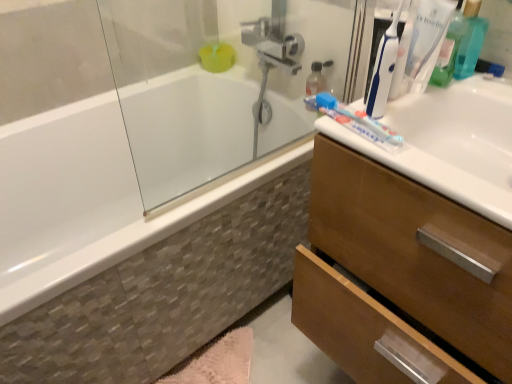
Locate an element on the screen. The image size is (512, 384). blue plastic toothbrush at upper right, marked as the second toothbrush in a right-to-left arrangement is located at coordinates (381, 61).

Describe the element at coordinates (218, 362) in the screenshot. I see `pink fluffy bath mat at lower center` at that location.

The image size is (512, 384). Describe the element at coordinates (160, 136) in the screenshot. I see `white glossy bathtub at left` at that location.

Identify the location of white glossy sink at upper right. pyautogui.click(x=450, y=143).

Who is taller, white glossy sink at upper right or pink fluffy bath mat at lower center?

Standing taller between the two is white glossy sink at upper right.

From a real-world perspective, relative to pink fluffy bath mat at lower center, is white glossy sink at upper right vertically above or below?

white glossy sink at upper right is situated higher than pink fluffy bath mat at lower center in the real world.

Which is in front, white glossy sink at upper right or pink fluffy bath mat at lower center?

white glossy sink at upper right is more forward.

What's the angular difference between white glossy sink at upper right and pink fluffy bath mat at lower center's facing directions?

They differ by 90 degrees in their facing directions.

Are white glossy bathtub at left and pink fluffy bath mat at lower center far apart?

That's not correct — white glossy bathtub at left is a little close to pink fluffy bath mat at lower center.

Considering the sizes of objects white glossy bathtub at left and pink fluffy bath mat at lower center in the image provided, who is thinner, white glossy bathtub at left or pink fluffy bath mat at lower center?

pink fluffy bath mat at lower center.

Considering the relative sizes of white glossy bathtub at left and pink fluffy bath mat at lower center in the image provided, is white glossy bathtub at left shorter than pink fluffy bath mat at lower center?

No, white glossy bathtub at left is not shorter than pink fluffy bath mat at lower center.

Which object is positioned more to the right, white glossy bathtub at left or white glossy sink at upper right?

Positioned to the right is white glossy sink at upper right.

Where is `sink positioned vertically above the white glossy bathtub at left (from a real-world perspective)`? The height and width of the screenshot is (384, 512). sink positioned vertically above the white glossy bathtub at left (from a real-world perspective) is located at coordinates (450, 143).

Is white glossy sink at upper right a part of white glossy bathtub at left?

No, white glossy sink at upper right is not surrounded by white glossy bathtub at left.

From the image's perspective, is wooden cabinet at right beneath white glossy bathtub at left?

Yes.

Considering the sizes of objects wooden cabinet at right and white glossy bathtub at left in the image provided, who is bigger, wooden cabinet at right or white glossy bathtub at left?

With larger size is white glossy bathtub at left.

Choose the correct answer: Is wooden cabinet at right inside white glossy bathtub at left or outside it?

wooden cabinet at right is not inside white glossy bathtub at left, it's outside.

How different are the orientations of white glossy sink at upper right and translucent plastic toothbrush at upper right, the second toothbrush in the left-to-right sequence, in degrees?

white glossy sink at upper right and translucent plastic toothbrush at upper right, the second toothbrush in the left-to-right sequence, are facing 0.459 degrees away from each other.

Based on the photo, is white glossy sink at upper right situated inside translucent plastic toothbrush at upper right, the second toothbrush in the left-to-right sequence, or outside?

white glossy sink at upper right exists outside the volume of translucent plastic toothbrush at upper right, the second toothbrush in the left-to-right sequence.

From a real-world perspective, which is physically below, white glossy sink at upper right or translucent plastic toothbrush at upper right, the second toothbrush in the left-to-right sequence?

white glossy sink at upper right is physically lower.

Does white glossy bathtub at left come in front of blue plastic toothbrush at upper right, acting as the 1th toothbrush starting from the left?

No.

The image size is (512, 384). In order to click on bathtub below the blue plastic toothbrush at upper right, marked as the second toothbrush in a right-to-left arrangement (from the image's perspective) in this screenshot , I will do `click(160, 136)`.

Is white glossy bathtub at left turned away from blue plastic toothbrush at upper right, acting as the 1th toothbrush starting from the left?

That's not correct — white glossy bathtub at left is not looking away from blue plastic toothbrush at upper right, acting as the 1th toothbrush starting from the left.

Considering the positions of point (148, 32) and point (390, 30), is point (148, 32) closer or farther from the camera than point (390, 30)?

Point (148, 32) is farther from the camera than point (390, 30).

From a real-world perspective, is translucent plastic toothbrush at upper right, the first toothbrush viewed from the right, located higher than white glossy sink at upper right?

Yes, from a real-world perspective, translucent plastic toothbrush at upper right, the first toothbrush viewed from the right, is over white glossy sink at upper right

Considering the relative positions of translucent plastic toothbrush at upper right, the first toothbrush viewed from the right, and white glossy sink at upper right in the image provided, is translucent plastic toothbrush at upper right, the first toothbrush viewed from the right, to the left of white glossy sink at upper right from the viewer's perspective?

Correct, you'll find translucent plastic toothbrush at upper right, the first toothbrush viewed from the right, to the left of white glossy sink at upper right.

Measure the distance from translucent plastic toothbrush at upper right, the first toothbrush viewed from the right, to white glossy sink at upper right.

15.15 centimeters.

Which of these two, translucent plastic toothbrush at upper right, the second toothbrush in the left-to-right sequence, or white glossy sink at upper right, is thinner?

translucent plastic toothbrush at upper right, the second toothbrush in the left-to-right sequence, is thinner.

Locate an element on the screen. The width and height of the screenshot is (512, 384). bath mat behind the white glossy sink at upper right is located at coordinates (218, 362).

Identify the location of bath mat on the right side of white glossy bathtub at left. Image resolution: width=512 pixels, height=384 pixels. (218, 362).

Looking at the image, which one is located closer to white glossy bathtub at left, blue plastic toothbrush at upper right, marked as the second toothbrush in a right-to-left arrangement, or translucent plastic toothbrush at upper right, the first toothbrush viewed from the right?

Among the two, blue plastic toothbrush at upper right, marked as the second toothbrush in a right-to-left arrangement, is located nearer to white glossy bathtub at left.

Looking at this image, when comparing their distances from blue plastic toothbrush at upper right, acting as the 1th toothbrush starting from the left, does pink fluffy bath mat at lower center or white glossy sink at upper right seem further?

pink fluffy bath mat at lower center.

Consider the image. Looking at the image, which one is located closer to blue plastic toothbrush at upper right, acting as the 1th toothbrush starting from the left, wooden cabinet at right or pink fluffy bath mat at lower center?

wooden cabinet at right is positioned closer to the anchor blue plastic toothbrush at upper right, acting as the 1th toothbrush starting from the left.

From the image, which object appears to be nearer to wooden cabinet at right, white glossy bathtub at left or translucent plastic toothbrush at upper right, the second toothbrush in the left-to-right sequence?

translucent plastic toothbrush at upper right, the second toothbrush in the left-to-right sequence, is closer to wooden cabinet at right.

Looking at the image, which one is located closer to white glossy sink at upper right, pink fluffy bath mat at lower center or white glossy bathtub at left?

white glossy bathtub at left.

Considering their positions, is translucent plastic toothbrush at upper right, the first toothbrush viewed from the right, positioned further to white glossy bathtub at left than pink fluffy bath mat at lower center?

Based on the image, translucent plastic toothbrush at upper right, the first toothbrush viewed from the right, appears to be further to white glossy bathtub at left.

Considering their positions, is pink fluffy bath mat at lower center positioned closer to translucent plastic toothbrush at upper right, the second toothbrush in the left-to-right sequence, than wooden cabinet at right?

wooden cabinet at right is closer to translucent plastic toothbrush at upper right, the second toothbrush in the left-to-right sequence.

Based on their spatial positions, is white glossy bathtub at left or wooden cabinet at right closer to blue plastic toothbrush at upper right, marked as the second toothbrush in a right-to-left arrangement?

The object closer to blue plastic toothbrush at upper right, marked as the second toothbrush in a right-to-left arrangement, is wooden cabinet at right.

What are the coordinates of `sink between translucent plastic toothbrush at upper right, the first toothbrush viewed from the right, and wooden cabinet at right, in the vertical direction` in the screenshot? It's located at tap(450, 143).

I want to click on toothbrush between translucent plastic toothbrush at upper right, the first toothbrush viewed from the right, and wooden cabinet at right, in the vertical direction, so click(x=381, y=61).

Where is `sink that lies between blue plastic toothbrush at upper right, acting as the 1th toothbrush starting from the left, and pink fluffy bath mat at lower center from top to bottom`? The image size is (512, 384). sink that lies between blue plastic toothbrush at upper right, acting as the 1th toothbrush starting from the left, and pink fluffy bath mat at lower center from top to bottom is located at coordinates (450, 143).

Locate an element on the screen. The width and height of the screenshot is (512, 384). bathroom cabinet between blue plastic toothbrush at upper right, acting as the 1th toothbrush starting from the left, and pink fluffy bath mat at lower center in the up-down direction is located at coordinates (401, 274).